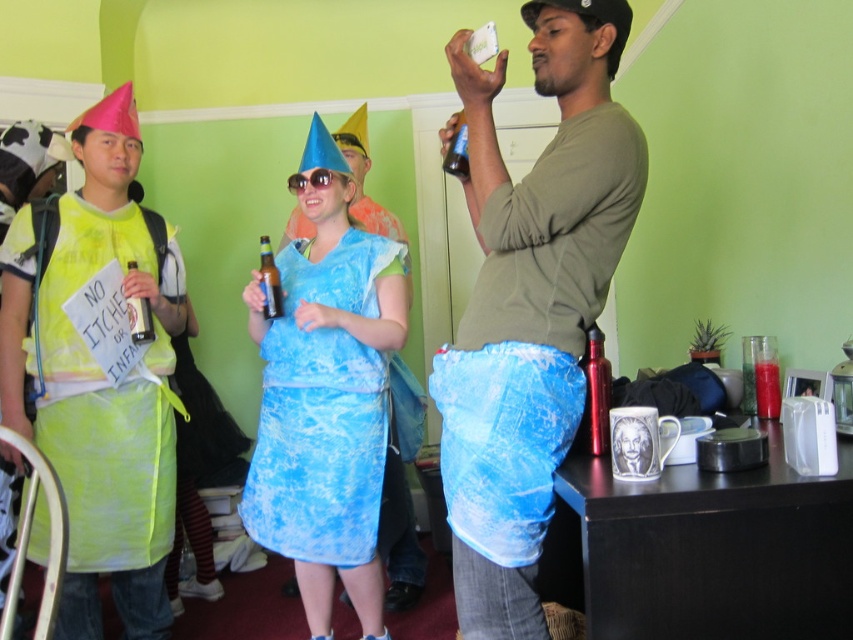
You are a photographer trying to capture both the blue denim shorts at center and the yellow fabric apron at left in a single frame. Based on their heights, which object should you focus on first to ensure both are in the shot?

The blue denim shorts at center is shorter than the yellow fabric apron at left. To capture both in a single frame, focus on positioning the camera so the taller yellow fabric apron at left is within the upper portion of the frame while ensuring the shorter blue denim shorts at center are centered or slightly lower.

You are organizing a costume party and need to decide which costume takes up more space. Based on the image, which of the two costumes is larger in size between the blue denim shorts at center and the yellow fabric apron at left?

The yellow fabric apron at left is larger in size compared to the blue denim shorts at center.